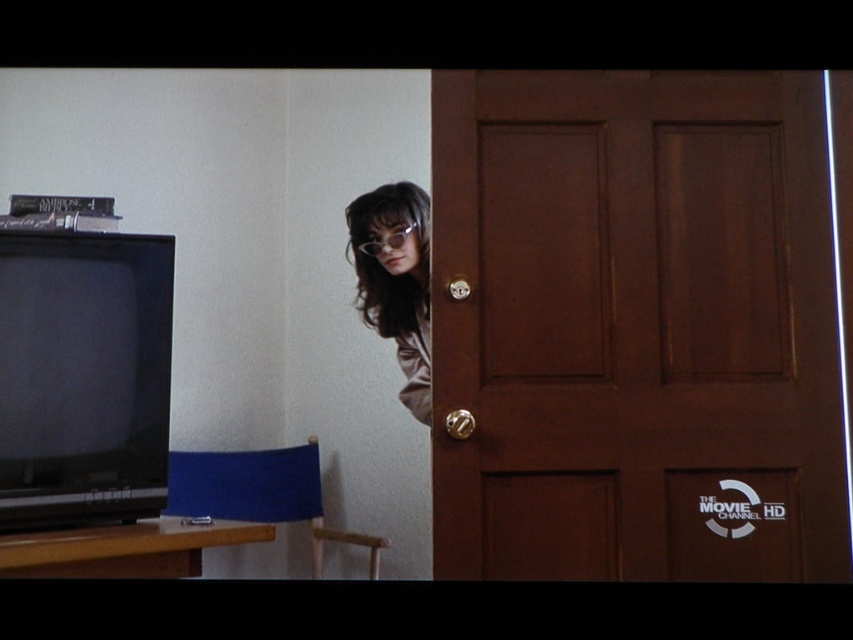
Question: Estimate the real-world distances between objects in this image. Which object is farther from the gold metallic door handle at center?

Choices:
 (A) satin brown hair at upper center
 (B) satin silver knob at center
 (C) black matte television at left
 (D) brown wooden door at center

Answer: (C)

Question: Is black matte television at left below satin brown hair at upper center?

Choices:
 (A) no
 (B) yes

Answer: (B)

Question: Which point is closer to the camera taking this photo?

Choices:
 (A) (361, 300)
 (B) (672, 276)
 (C) (453, 422)

Answer: (C)

Question: Is the position of black matte television at left more distant than that of satin silver knob at center?

Choices:
 (A) no
 (B) yes

Answer: (A)

Question: Is black matte television at left thinner than satin brown hair at upper center?

Choices:
 (A) no
 (B) yes

Answer: (A)

Question: Which point is closer to the camera?

Choices:
 (A) satin brown hair at upper center
 (B) satin silver knob at center

Answer: (B)